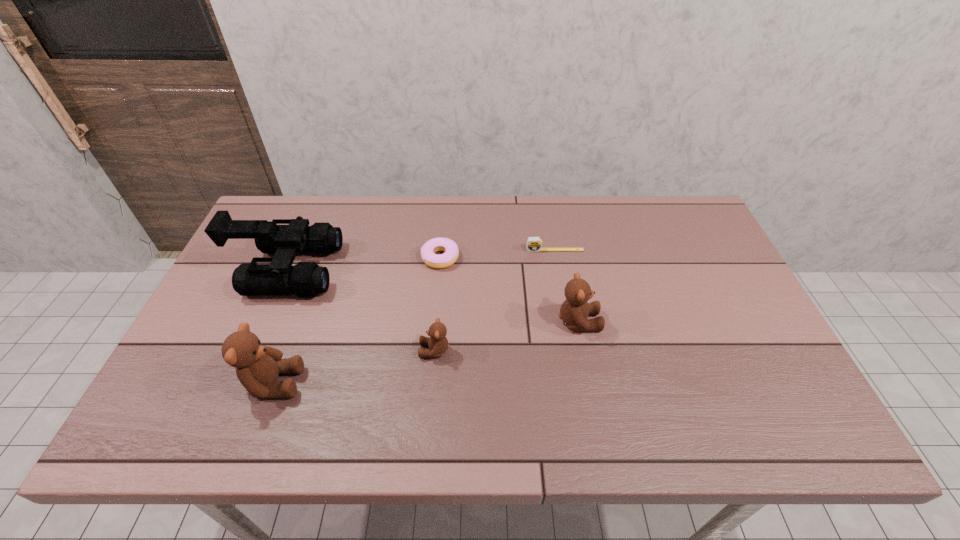
Please point out where to position a new teddy bear on the right to maintain spacing. Please provide its 2D coordinates. Your answer should be formatted as a tuple, i.e. [(x, y)], where the tuple contains the x and y coordinates of a point satisfying the conditions above.

[(708, 296)]